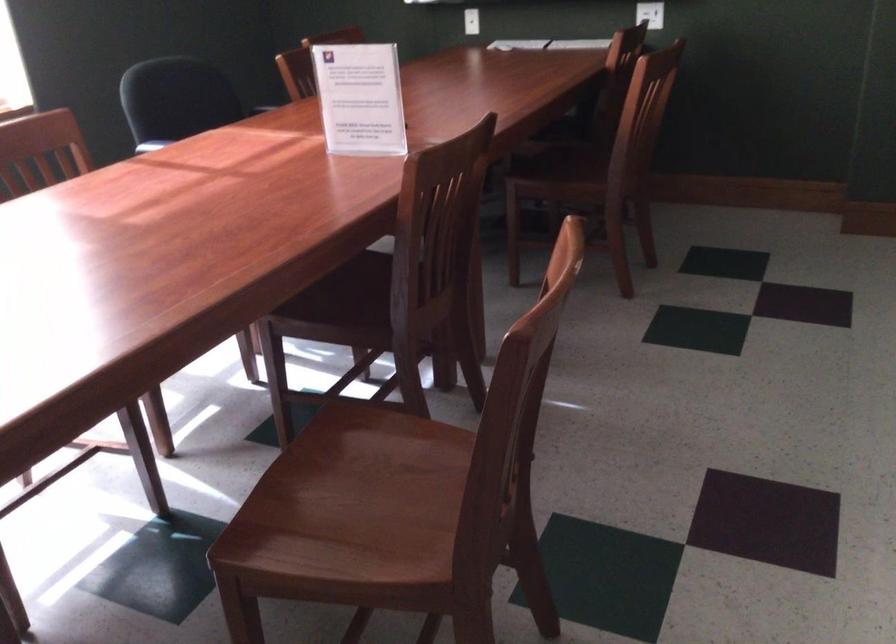
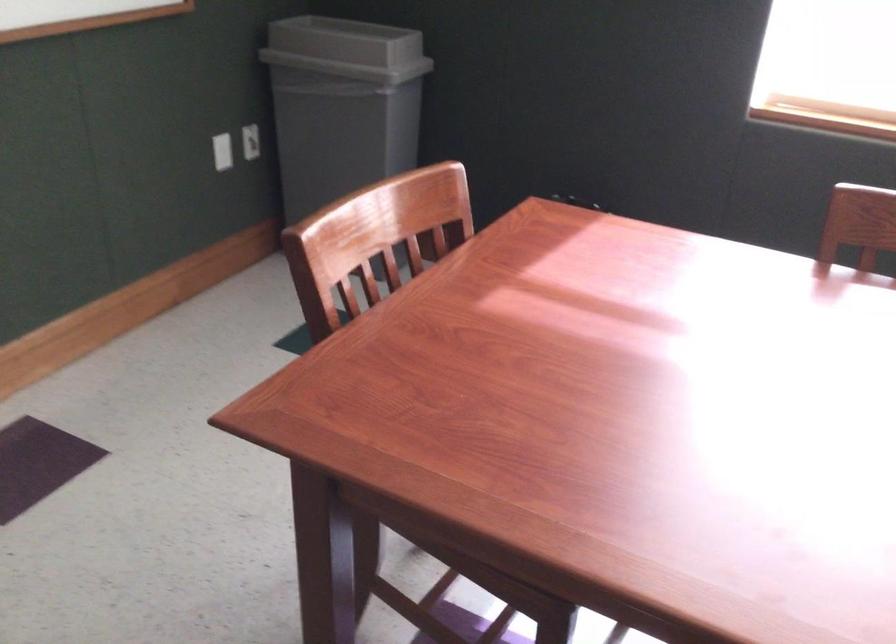
In the scene shown: How did the camera likely rotate?

The rotation direction of the camera is left-down.